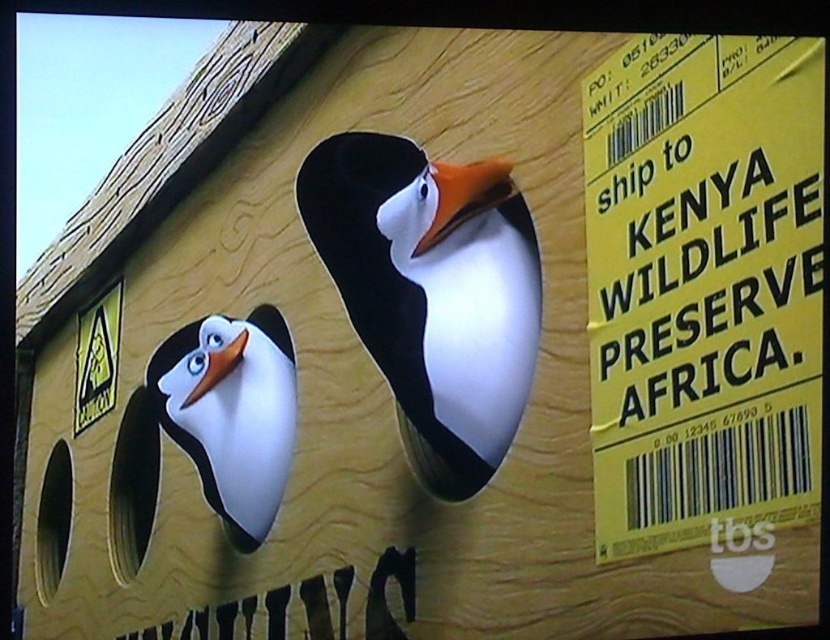
Question: Which of these objects is positioned farthest from the orange matte beak at center?

Choices:
 (A) white matte penguin at center
 (B) matte orange beak at left
 (C) yellow paper at right
 (D) white glossy penguin at left

Answer: (D)

Question: Which is farther from the matte orange beak at left?

Choices:
 (A) orange matte beak at center
 (B) white matte penguin at center
 (C) yellow paper at right
 (D) white glossy penguin at left

Answer: (C)

Question: Does yellow paper at right have a larger size compared to matte orange beak at left?

Choices:
 (A) no
 (B) yes

Answer: (B)

Question: Which of the following is the closest to the observer?

Choices:
 (A) white glossy penguin at left
 (B) white matte penguin at center
 (C) orange matte beak at center
 (D) matte orange beak at left

Answer: (B)

Question: Is the position of white glossy penguin at left less distant than that of matte orange beak at left?

Choices:
 (A) yes
 (B) no

Answer: (A)

Question: In this image, where is white glossy penguin at left located relative to orange matte beak at center?

Choices:
 (A) below
 (B) above

Answer: (A)